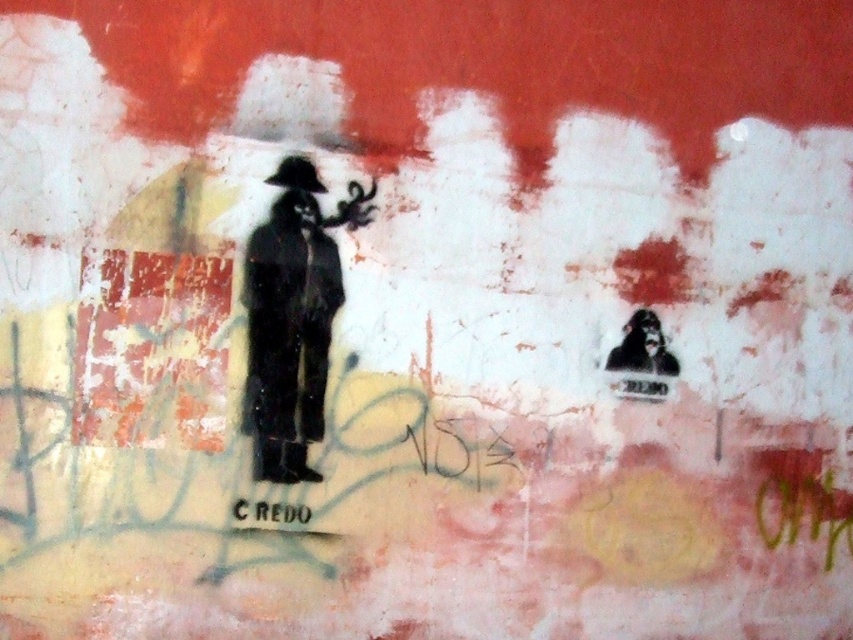
You are an art restorer examining the weathered wall. You need to clean the black matte figure at center and the smooth black mask at upper right. Which object should you clean first if you want to start from the top of the wall?

The black matte figure at center should be cleaned first because it is located above the smooth black mask at upper right, meaning it is positioned higher up on the wall.

You are an art student analyzing the wall art. You notice the black matte figure at center and the smooth black mask at upper right. Which object is positioned to the right side of the other?

The smooth black mask at upper right is positioned to the right of the black matte figure at center.